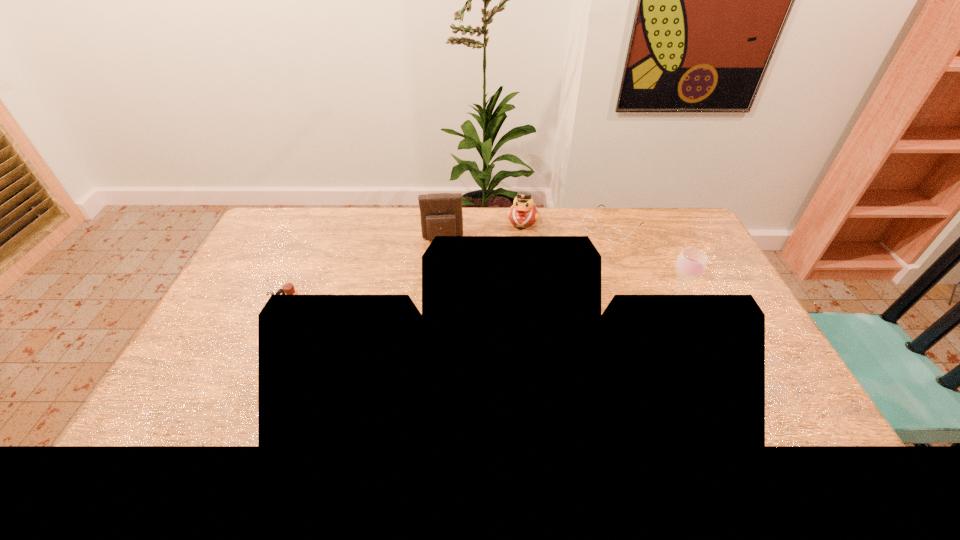
Identify the location of vacant space that's between the shortest object and the duck. (567, 224).

Find the location of a particular element. free spot between the third object from right to left and the second object from left to right is located at coordinates (483, 230).

Locate an element on the screen. vacant space that's between the pouch and the leftmost object is located at coordinates (367, 275).

Where is `vacant area between the second object from left to right and the wineglass`? The width and height of the screenshot is (960, 540). vacant area between the second object from left to right and the wineglass is located at coordinates (559, 272).

Identify the location of unoccupied area between the duck and the pouch. This screenshot has height=540, width=960. (483, 230).

Locate an element on the screen. The width and height of the screenshot is (960, 540). unoccupied position between the pouch and the leftmost object is located at coordinates (367, 275).

Where is `unoccupied area between the second object from left to right and the spectacles`? The image size is (960, 540). unoccupied area between the second object from left to right and the spectacles is located at coordinates pos(527,233).

Choose which object is the fourth nearest neighbor to the wineglass. Please provide its 2D coordinates. Your answer should be formatted as a tuple, i.e. [(x, y)], where the tuple contains the x and y coordinates of a point satisfying the conditions above.

[(288, 289)]

Identify which object is the closest to the leftmost object. Please provide its 2D coordinates. Your answer should be formatted as a tuple, i.e. [(x, y)], where the tuple contains the x and y coordinates of a point satisfying the conditions above.

[(441, 214)]

Find the location of `vacant point that satisfies the following two spatial constraints: 1. on the front side of the shortest object; 2. on the right side of the wineglass`. vacant point that satisfies the following two spatial constraints: 1. on the front side of the shortest object; 2. on the right side of the wineglass is located at coordinates (x=641, y=305).